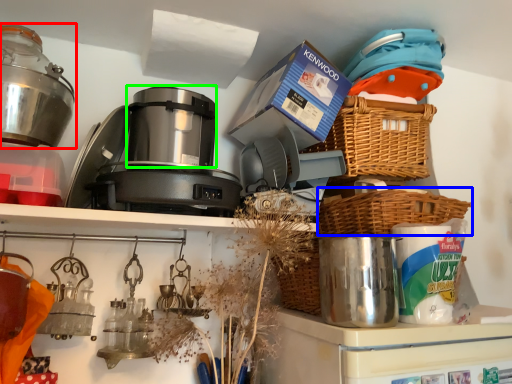
Question: Which object is the closest to the kitchen appliance (highlighted by a red box)? Choose among these: basket (highlighted by a blue box) or appliance (highlighted by a green box).

Choices:
 (A) basket
 (B) appliance

Answer: (B)